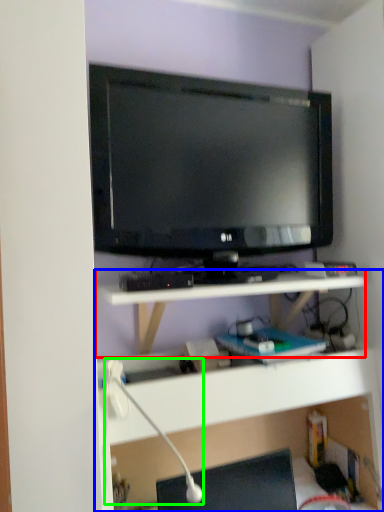
Question: Which object is the closest to the shelf (highlighted by a red box)? Choose among these: shelf (highlighted by a blue box) or lamp (highlighted by a green box).

Choices:
 (A) shelf
 (B) lamp

Answer: (A)